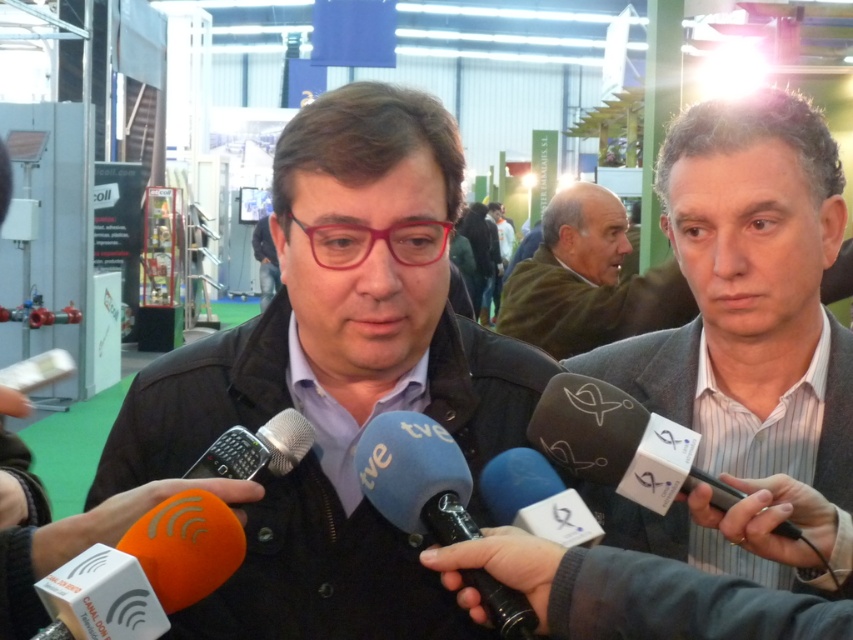
Can you confirm if gray wool sweater at center is thinner than blue fabric microphone at center?

In fact, gray wool sweater at center might be wider than blue fabric microphone at center.

You are a GUI agent. You are given a task and a screenshot of the screen. Output one action in this format:
    pyautogui.click(x=<x>, y=<y>)
    Task: Click on the gray wool sweater at center
    The image size is (853, 640).
    Given the screenshot: What is the action you would take?
    pyautogui.click(x=589, y=280)

Locate an element on the screen. This screenshot has height=640, width=853. gray wool sweater at center is located at coordinates (589, 280).

Is gray striped shirt at right taller than gray wool sweater at center?

Yes.

Who is lower down, gray striped shirt at right or gray wool sweater at center?

gray striped shirt at right is below.

Find the location of a particular element. gray striped shirt at right is located at coordinates (749, 294).

Measure the distance between gray striped shirt at right and white plastic microphone at center.

25.45 centimeters

Locate an element on the screen. gray striped shirt at right is located at coordinates (749, 294).

Find the location of a particular element. gray striped shirt at right is located at coordinates (749, 294).